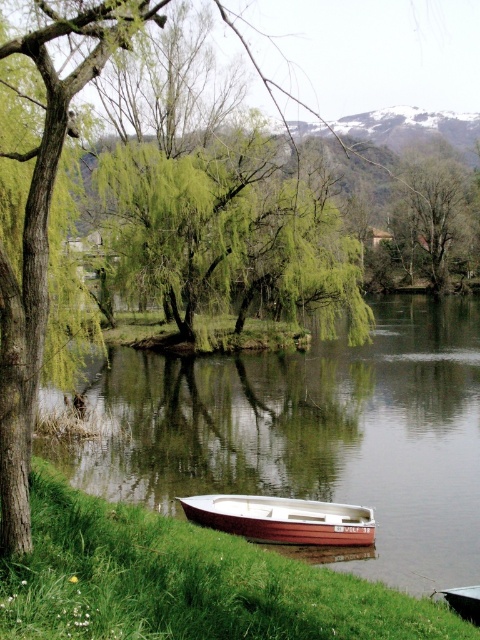
Consider the image. Between smooth brown water at lower center and wooden boat at lower center, which one appears on the right side from the viewer's perspective?

From the viewer's perspective, smooth brown water at lower center appears more on the right side.

Is smooth brown water at lower center bigger than wooden boat at lower center?

Indeed, smooth brown water at lower center has a larger size compared to wooden boat at lower center.

Is point (415, 397) in front of point (253, 524)?

No, (415, 397) is further to viewer.

You are a GUI agent. You are given a task and a screenshot of the screen. Output one action in this format:
    pyautogui.click(x=<x>, y=<y>)
    Task: Click on the smooth brown water at lower center
    
    Given the screenshot: What is the action you would take?
    pyautogui.click(x=312, y=433)

Who is more forward, (191, 621) or (468, 266)?

Point (191, 621) is more forward.

Is point (58, 625) behind point (431, 182)?

No, (58, 625) is in front of (431, 182).

Locate an element on the screen. The width and height of the screenshot is (480, 640). green grass at lower left is located at coordinates (186, 582).

Between wooden boat at lower center and white wooden boat at lower center, which one has less height?

With less height is white wooden boat at lower center.

At what (x,y) coordinates should I click in order to perform the action: click on wooden boat at lower center. Please return your answer as a coordinate pair (x, y). This screenshot has width=480, height=640. Looking at the image, I should click on (283, 518).

Where is `wooden boat at lower center`? The image size is (480, 640). wooden boat at lower center is located at coordinates (283, 518).